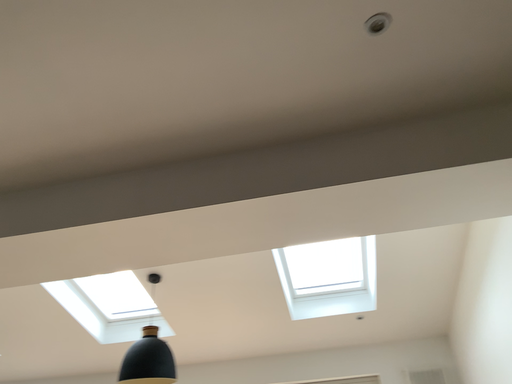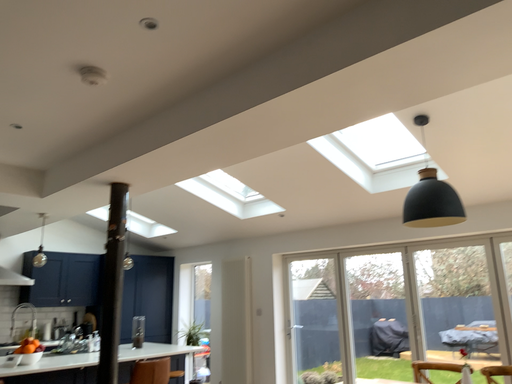
Question: Which way did the camera rotate in the video?

Choices:
 (A) rotated right
 (B) rotated left

Answer: (B)